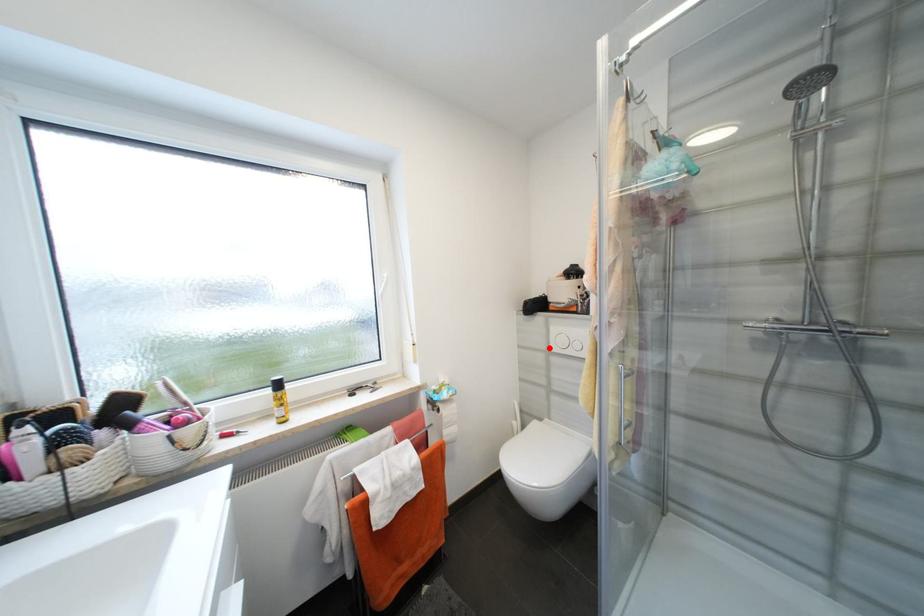
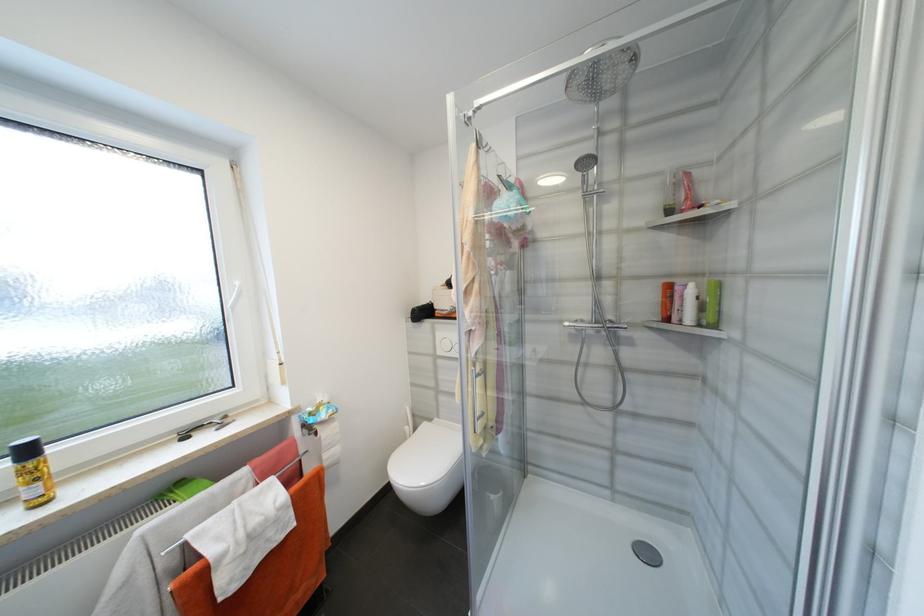
In the second image, find the point that corresponds to the highlighted location in the first image.

(436, 352)